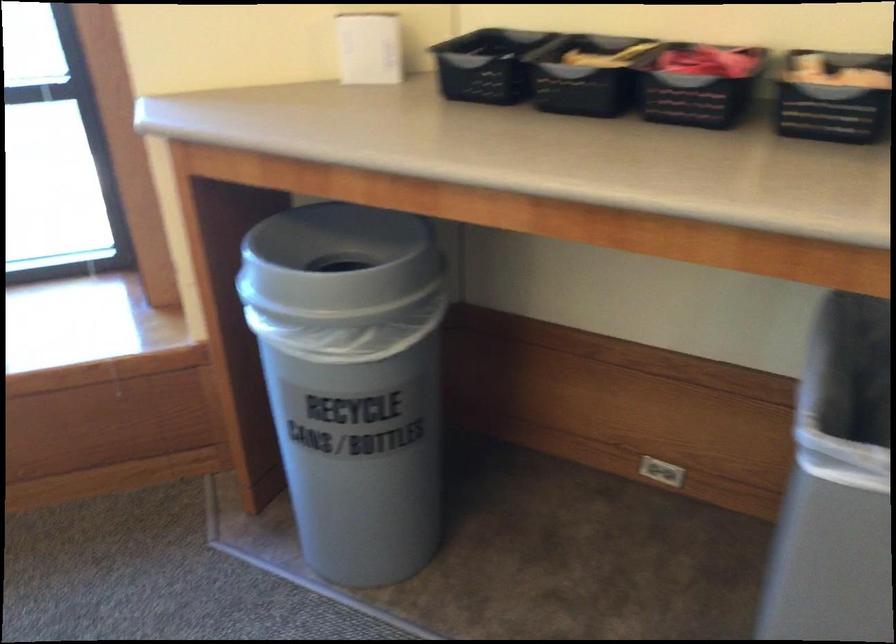
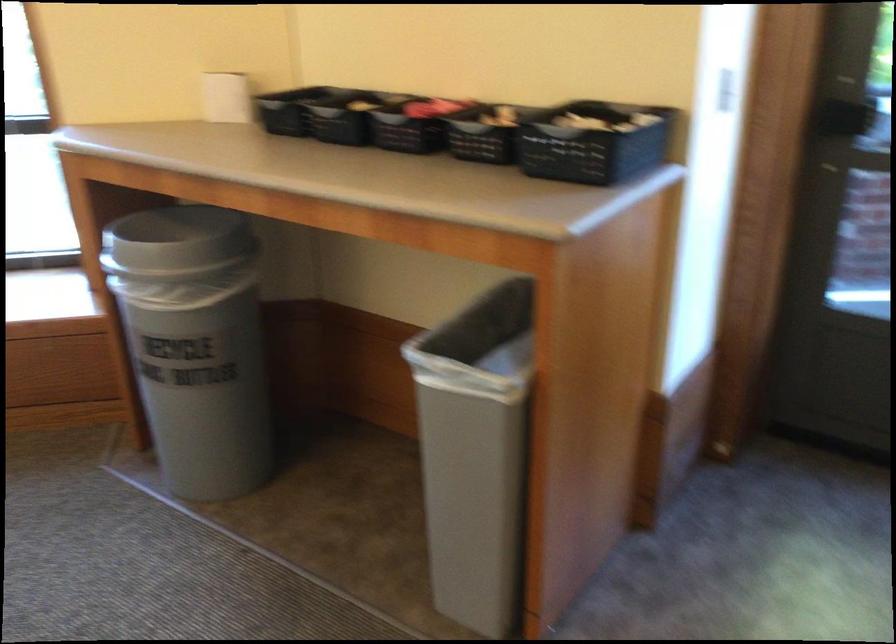
Find the pixel in the second image that matches the point at 711,86 in the first image.

(410, 122)